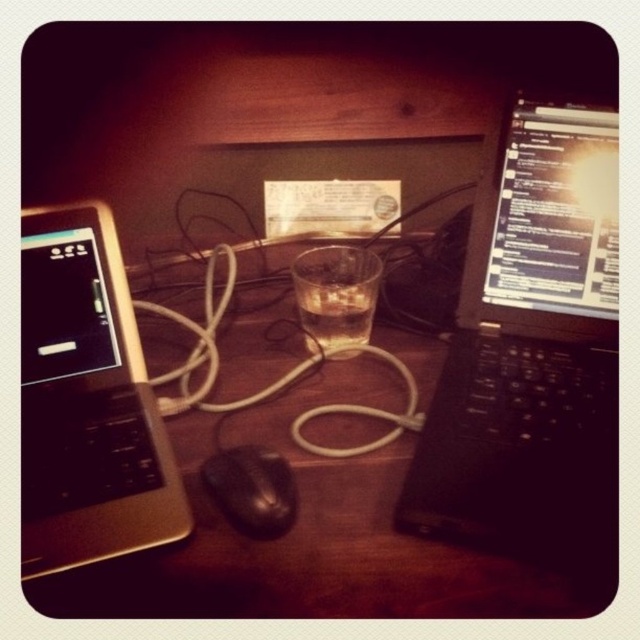
You are organizing the desk and want to place a new keyboard between the silver metallic laptop at left and the black matte mouse at center. Based on their current positions, where should you position the keyboard?

The keyboard should be placed between the silver metallic laptop at left and the black matte mouse at center since the silver metallic laptop at left is to the left of the black matte mouse at center, making the space between them suitable for the keyboard.

You are setting up a new monitor that requires at least 15 inches of desk space. You have to choose between placing it next to the black matte laptop at right or the silver metallic laptop at left. Based on their widths, which laptop should you place the monitor next to?

The black matte laptop at right has a greater width than the silver metallic laptop at left, so placing the monitor next to the black matte laptop at right would provide more desk space for the monitor.

You are a delivery drone trying to land on the desk between the two laptops. The landing coordinates are given as two points on the desk surface. Which point is closer to you, point (560, 122) or point (56, 387)?

Point (560, 122) is further to the viewer than point (56, 387), so the closer point to you is point (56, 387).